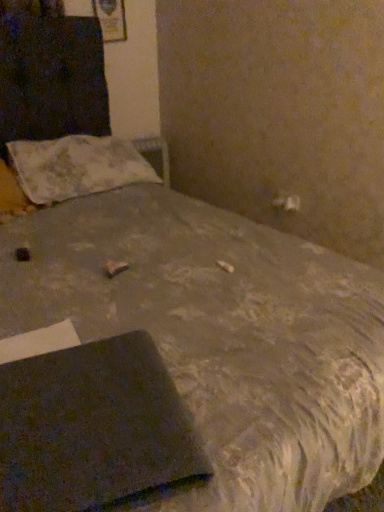
This screenshot has width=384, height=512. What are the coordinates of `empty space that is ontop of dark gray matte notebook at lower left (from a real-world perspective)` in the screenshot? It's located at (89, 406).